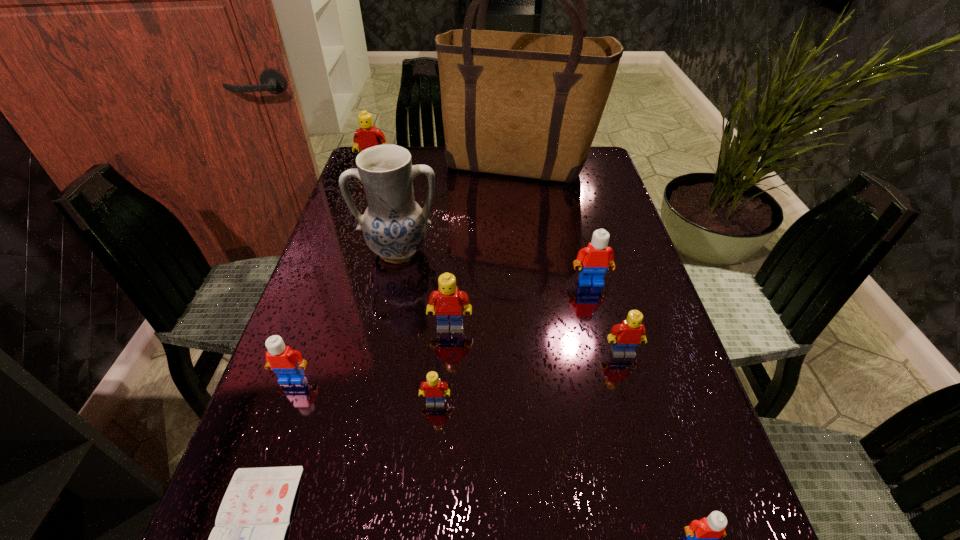
The width and height of the screenshot is (960, 540). Identify the location of vacant space at the left edge of the desktop. (328, 378).

Locate an element on the screen. The image size is (960, 540). free space at the right edge is located at coordinates (612, 208).

Find the location of a particular element. The image size is (960, 540). vacant area that lies between the second smallest white Lego and the fourth nearest Lego is located at coordinates (457, 365).

In order to click on free space that is in between the nearest yellow Lego and the leftmost white Lego in this screenshot , I will do (x=364, y=390).

Find the location of a particular element. free spot between the sixth nearest object and the seventh farthest object is located at coordinates (372, 353).

Find the location of a particular element. The image size is (960, 540). vacant space that is in between the fifth nearest object and the seventh farthest object is located at coordinates (457, 365).

Locate an element on the screen. This screenshot has width=960, height=540. vacant area that lies between the fifth nearest object and the second biggest yellow Lego is located at coordinates (537, 340).

I want to click on vacant area between the eighth farthest object and the biggest white Lego, so click(513, 342).

Identify which object is located as the seventh nearest to the second farthest white Lego. Please provide its 2D coordinates. Your answer should be formatted as a tuple, i.e. [(x, y)], where the tuple contains the x and y coordinates of a point satisfying the conditions above.

[(702, 535)]

Where is `object that is the fifth closest to the sixth farthest object`? This screenshot has width=960, height=540. object that is the fifth closest to the sixth farthest object is located at coordinates (394, 226).